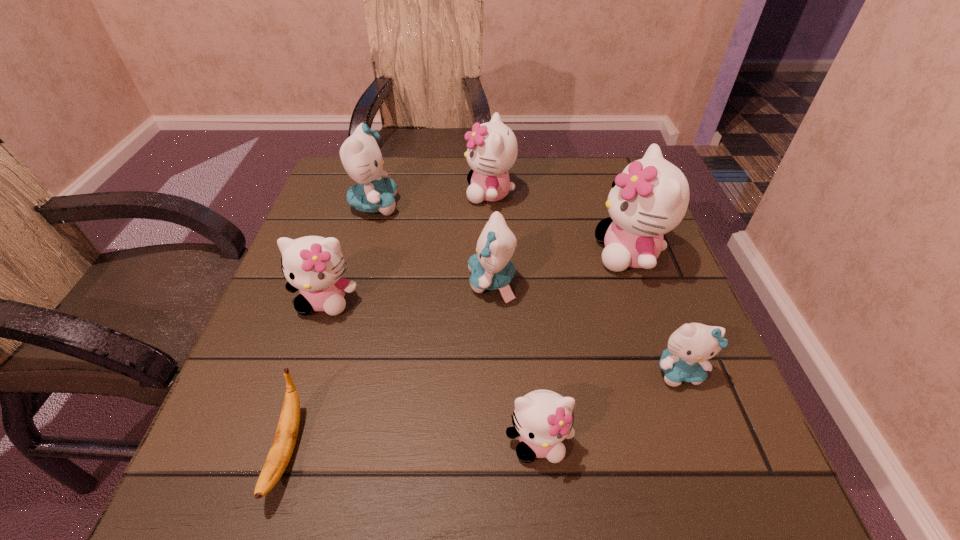
Identify the location of vacant region located 0.200m on the front-facing side of the farthest white kitten. This screenshot has height=540, width=960. (387, 193).

This screenshot has height=540, width=960. Identify the location of vacant space located 0.270m on the face of the second nearest blue kitten. point(335,282).

Locate an element on the screen. vacant space located on the face of the second nearest blue kitten is located at coordinates (325, 282).

Image resolution: width=960 pixels, height=540 pixels. Identify the location of free space located on the face of the second nearest blue kitten. (423, 282).

At what (x,y) coordinates should I click in order to perform the action: click on free space located 0.180m on the front-facing side of the leftmost white kitten. Please return your answer as a coordinate pair (x, y). Looking at the image, I should click on point(290,408).

Find the location of a particular element. This screenshot has height=540, width=960. free region located on the face of the third nearest object is located at coordinates (731, 509).

Image resolution: width=960 pixels, height=540 pixels. What are the coordinates of `kitten that is at the near edge` in the screenshot? It's located at (542, 419).

Locate an element on the screen. This screenshot has height=540, width=960. banana that is at the near edge is located at coordinates (284, 441).

Identify the location of banana that is at the left edge. This screenshot has height=540, width=960. (284, 441).

At what (x,y) coordinates should I click in order to perform the action: click on object positioned at the far left corner. Please return your answer as a coordinate pair (x, y). The height and width of the screenshot is (540, 960). Looking at the image, I should click on (360, 154).